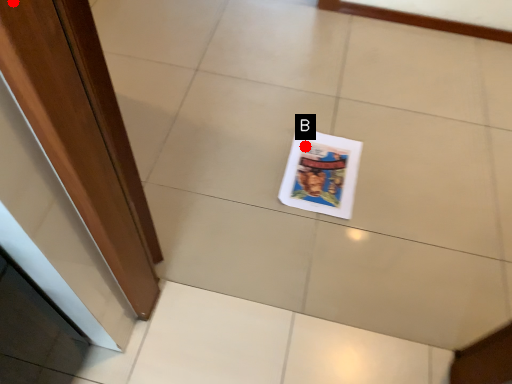
Question: Two points are circled on the image, labeled by A and B beside each circle. Which point is further to the camera?

Choices:
 (A) A is further
 (B) B is further

Answer: (B)